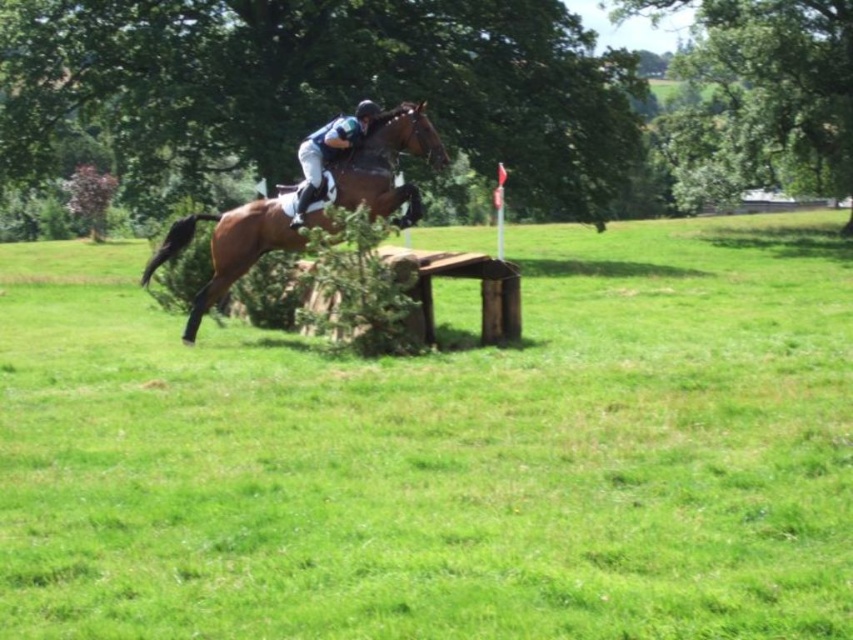
Question: Is brown glossy horse at center below shiny blue helmet at center?

Choices:
 (A) no
 (B) yes

Answer: (B)

Question: Which of the following is the farthest from the observer?

Choices:
 (A) (299, 467)
 (B) (368, 106)

Answer: (B)

Question: Which point is closer to the camera taking this photo?

Choices:
 (A) (247, 205)
 (B) (334, 147)
 (C) (660, 381)

Answer: (C)

Question: Can you confirm if brown glossy horse at center is positioned to the right of shiny blue helmet at center?

Choices:
 (A) no
 (B) yes

Answer: (A)

Question: Does brown wooden fence at center appear over shiny blue helmet at center?

Choices:
 (A) yes
 (B) no

Answer: (B)

Question: Which object is positioned farthest from the brown wooden fence at center?

Choices:
 (A) shiny blue helmet at center
 (B) brown glossy horse at center

Answer: (B)